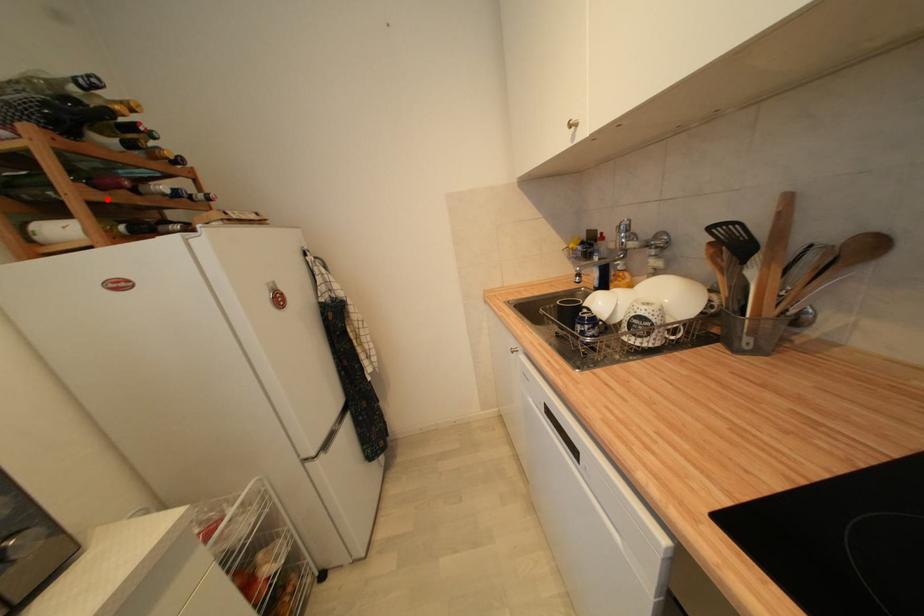
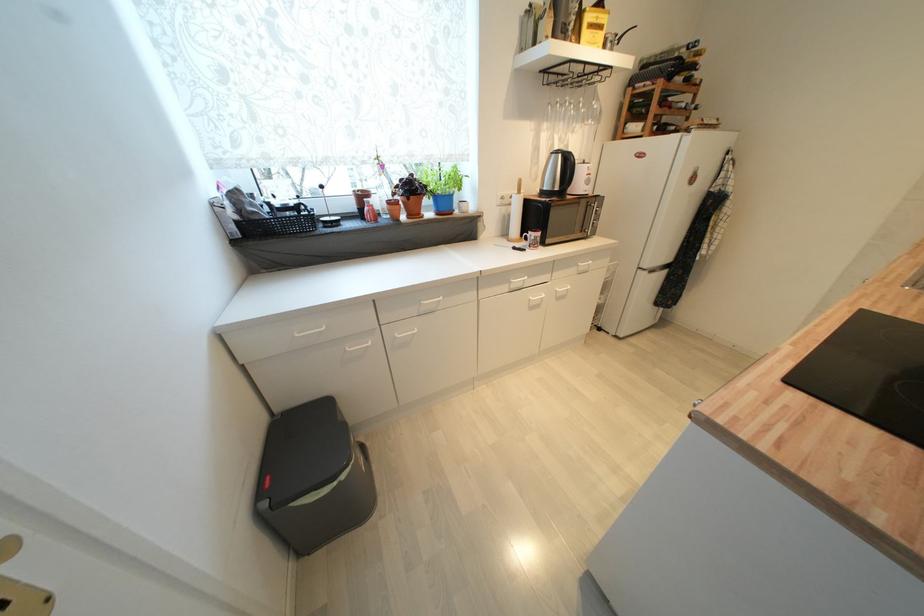
Find the pixel in the second image that matches the highlighted location in the first image.

(664, 114)